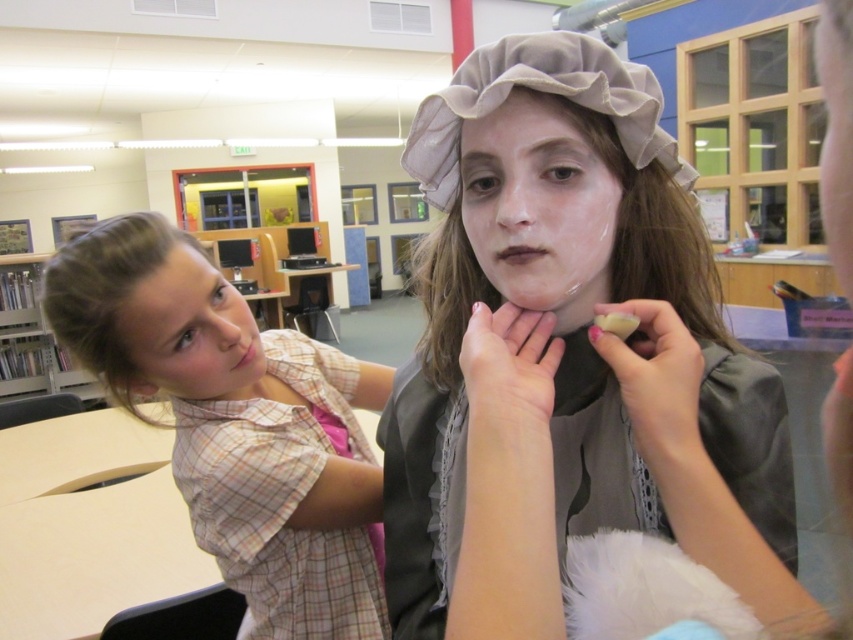
You are organizing a costume party and need to ensure that the plaid shirt at center and the matte white face at center can be seen clearly in photos. Based on their sizes, which one is more likely to be the main focus in a photo taken from the front of the room?

The plaid shirt at center is larger in size than the matte white face at center, so the plaid shirt at center is more likely to be the main focus in a photo taken from the front of the room.